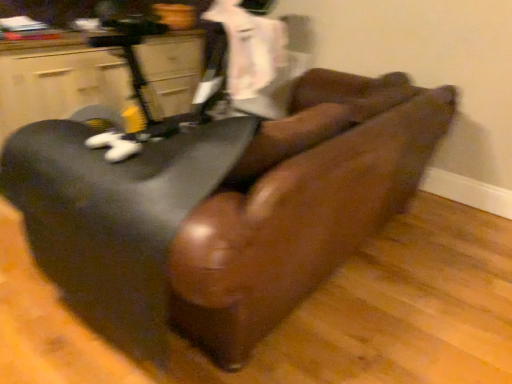
Question: In terms of height, does leather couch at center, the first furniture positioned from the right, look taller or shorter compared to matte black chair at left, the 2th furniture positioned from the right?

Choices:
 (A) tall
 (B) short

Answer: (A)

Question: From a real-world perspective, is leather couch at center, the first furniture positioned from the right, above or below matte black chair at left, which is counted as the 1th furniture, starting from the left?

Choices:
 (A) above
 (B) below

Answer: (B)

Question: Is point (249, 347) closer or farther from the camera than point (2, 84)?

Choices:
 (A) farther
 (B) closer

Answer: (B)

Question: From a real-world perspective, is matte black chair at left, which is counted as the 1th furniture, starting from the left, positioned above or below leather couch at center, the first furniture positioned from the right?

Choices:
 (A) above
 (B) below

Answer: (A)

Question: Is point (140, 46) closer or farther from the camera than point (326, 168)?

Choices:
 (A) farther
 (B) closer

Answer: (A)

Question: In terms of size, does matte black chair at left, which is counted as the 1th furniture, starting from the left, appear bigger or smaller than leather couch at center, which ranks as the 2th furniture in left-to-right order?

Choices:
 (A) small
 (B) big

Answer: (A)

Question: Considering the relative positions of matte black chair at left, which is counted as the 1th furniture, starting from the left, and leather couch at center, the first furniture positioned from the right, in the image provided, is matte black chair at left, which is counted as the 1th furniture, starting from the left, to the left or to the right of leather couch at center, the first furniture positioned from the right,?

Choices:
 (A) left
 (B) right

Answer: (A)